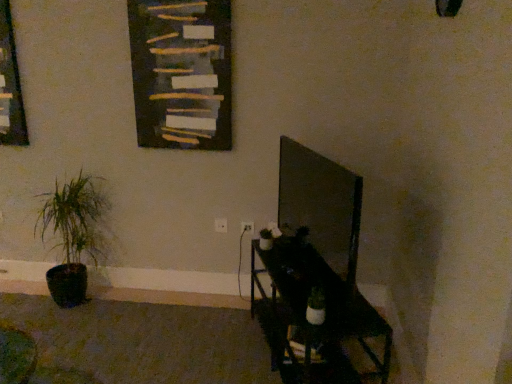
Question: Looking at the image, does green matte plant at left seem bigger or smaller compared to dark wood bulletin board at upper center?

Choices:
 (A) big
 (B) small

Answer: (A)

Question: In terms of height, does green matte plant at left look taller or shorter compared to dark wood bulletin board at upper center?

Choices:
 (A) tall
 (B) short

Answer: (A)

Question: Estimate the real-world distances between objects in this image. Which object is closer to the green matte plant at left?

Choices:
 (A) metallic black shelf at lower right
 (B) wooden frame at left
 (C) dark wood bulletin board at upper center

Answer: (B)

Question: Based on their relative distances, which object is nearer to the green matte plant at left?

Choices:
 (A) dark wood bulletin board at upper center
 (B) wooden frame at left
 (C) metallic black shelf at lower right

Answer: (B)